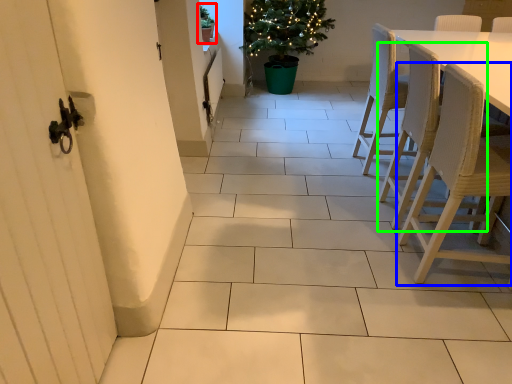
Question: Based on their relative distances, which object is farther from houseplant (highlighted by a red box)? Choose from chair (highlighted by a blue box) and chair (highlighted by a green box).

Choices:
 (A) chair
 (B) chair

Answer: (A)